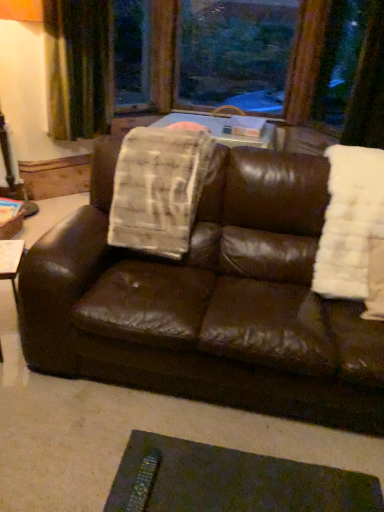
Question: Which direction should I rotate to face transparent glass window at upper center, the second window screen viewed from the left, — up or down?

Choices:
 (A) up
 (B) down

Answer: (A)

Question: Is the depth of brown leather couch at center greater than that of transparent glass window at upper center, the second window screen viewed from the left?

Choices:
 (A) no
 (B) yes

Answer: (A)

Question: Is brown leather couch at center at the left side of transparent glass window at upper center, placed as the first window screen when sorted from right to left?

Choices:
 (A) no
 (B) yes

Answer: (B)

Question: Is transparent glass window at upper center, placed as the first window screen when sorted from right to left, a part of brown leather couch at center?

Choices:
 (A) yes
 (B) no

Answer: (B)

Question: Does brown leather couch at center have a smaller size compared to transparent glass window at upper center, placed as the first window screen when sorted from right to left?

Choices:
 (A) yes
 (B) no

Answer: (B)

Question: Is there a large distance between brown leather couch at center and transparent glass window at upper center, the second window screen viewed from the left?

Choices:
 (A) no
 (B) yes

Answer: (B)

Question: Considering the relative sizes of brown leather couch at center and transparent glass window at upper center, placed as the first window screen when sorted from right to left, in the image provided, is brown leather couch at center bigger than transparent glass window at upper center, placed as the first window screen when sorted from right to left,?

Choices:
 (A) yes
 (B) no

Answer: (A)

Question: Does metallic textured remote at lower center have a greater width compared to white fluffy blanket at right, marked as the first blanket in a right-to-left arrangement?

Choices:
 (A) no
 (B) yes

Answer: (A)

Question: Is metallic textured remote at lower center smaller than white fluffy blanket at right, marked as the first blanket in a right-to-left arrangement?

Choices:
 (A) yes
 (B) no

Answer: (A)

Question: From a real-world perspective, is metallic textured remote at lower center positioned under white fluffy blanket at right, the second blanket in the left-to-right sequence, based on gravity?

Choices:
 (A) no
 (B) yes

Answer: (B)

Question: Can you confirm if metallic textured remote at lower center is taller than white fluffy blanket at right, marked as the first blanket in a right-to-left arrangement?

Choices:
 (A) no
 (B) yes

Answer: (A)

Question: Is metallic textured remote at lower center closer to the viewer compared to white fluffy blanket at right, marked as the first blanket in a right-to-left arrangement?

Choices:
 (A) yes
 (B) no

Answer: (A)

Question: Could white fluffy blanket at right, marked as the first blanket in a right-to-left arrangement, be considered to be inside metallic textured remote at lower center?

Choices:
 (A) yes
 (B) no

Answer: (B)

Question: Is transparent glass window at upper center, the second window screen viewed from the left, placed right next to green velvet curtain at upper left?

Choices:
 (A) no
 (B) yes

Answer: (A)